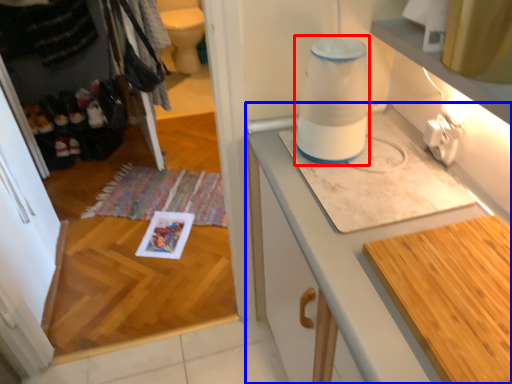
Question: Which point is further to the camera, blender (highlighted by a red box) or cabinetry (highlighted by a blue box)?

Choices:
 (A) blender
 (B) cabinetry

Answer: (A)